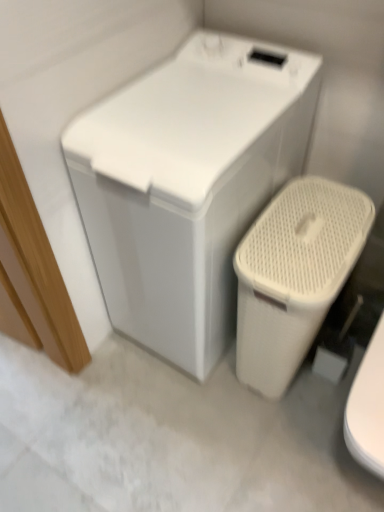
Question: Is white matte washing machine at upper center taller or shorter than beige textured plastic toilet at lower right?

Choices:
 (A) short
 (B) tall

Answer: (B)

Question: Is point (304, 150) closer or farther from the camera than point (266, 275)?

Choices:
 (A) closer
 (B) farther

Answer: (B)

Question: In the image, is white matte washing machine at upper center on the left side or the right side of beige textured plastic toilet at lower right?

Choices:
 (A) left
 (B) right

Answer: (A)

Question: Is point (324, 202) closer or farther from the camera than point (160, 183)?

Choices:
 (A) farther
 (B) closer

Answer: (A)

Question: Is beige textured plastic toilet at lower right spatially inside white matte washing machine at upper center, or outside of it?

Choices:
 (A) outside
 (B) inside

Answer: (A)

Question: In the image, is beige textured plastic toilet at lower right positioned in front of or behind white matte washing machine at upper center?

Choices:
 (A) front
 (B) behind

Answer: (B)

Question: From the image's perspective, is beige textured plastic toilet at lower right positioned above or below white matte washing machine at upper center?

Choices:
 (A) above
 (B) below

Answer: (B)